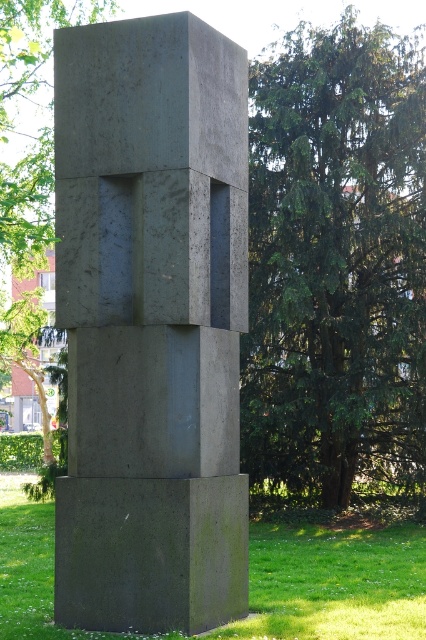
You are an artist planning to photograph the matte concrete sculpture at center and the green textured tree at center from a distance. Which object will appear wider in the photo?

The matte concrete sculpture at center will appear wider in the photo because its width surpasses that of the green textured tree at center.

You are standing at the entrance of the park and want to find the matte concrete sculpture at center. According to the map coordinates, where should you look to locate it?

The matte concrete sculpture at center is located at coordinates point (150, 323), so you should look there to find it.

You are an artist planning to place a new sculpture in the park. You see the matte concrete sculpture at center and the green textured tree at center. Which object should you consider in terms of size when choosing the placement for your new sculpture?

The matte concrete sculpture at center is bigger than the green textured tree at center, so you should consider the size of the matte concrete sculpture at center to ensure adequate space for the new sculpture.